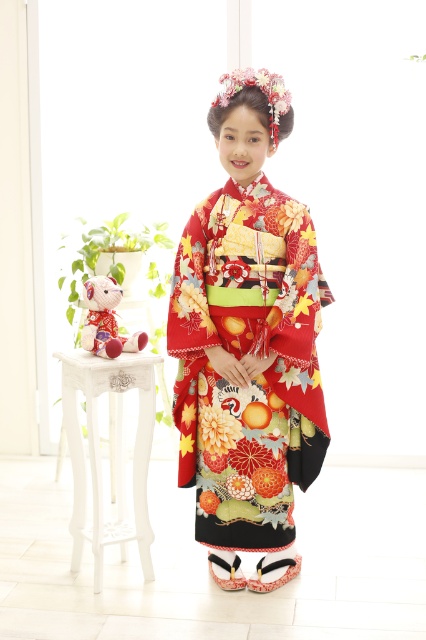
You are a photographer setting up for a photoshoot. You have a floral silk kimono at center and a velvet plush bear at left in the scene. You want to ensure that the kimono is the focal point. Considering their heights, which object should you position closer to the camera to emphasize its prominence?

The floral silk kimino at center has a greater height compared to the velvet plush bear at left, so positioning the floral silk kimino at center closer to the camera will emphasize its prominence due to its larger size.

You are a photographer setting up a shoot in the room described. You need to place a camera on the widest object at the left side of the scene. Which object should you choose between the white wood stool at left and the velvet plush bear at left?

The white wood stool at left might be wider than velvet plush bear at left, so you should place the camera on the white wood stool at left.

You are taking a photo of the person in the kimono and want to focus on two specific points. The first point is at coordinate point (x=253, y=420) and the second is at point (x=95, y=321). Which point should you focus on first if you want to ensure the closest point is in sharp focus?

You should focus on point (x=253, y=420) first because it is closer to the camera than point (x=95, y=321), ensuring the closest point is in sharp focus.